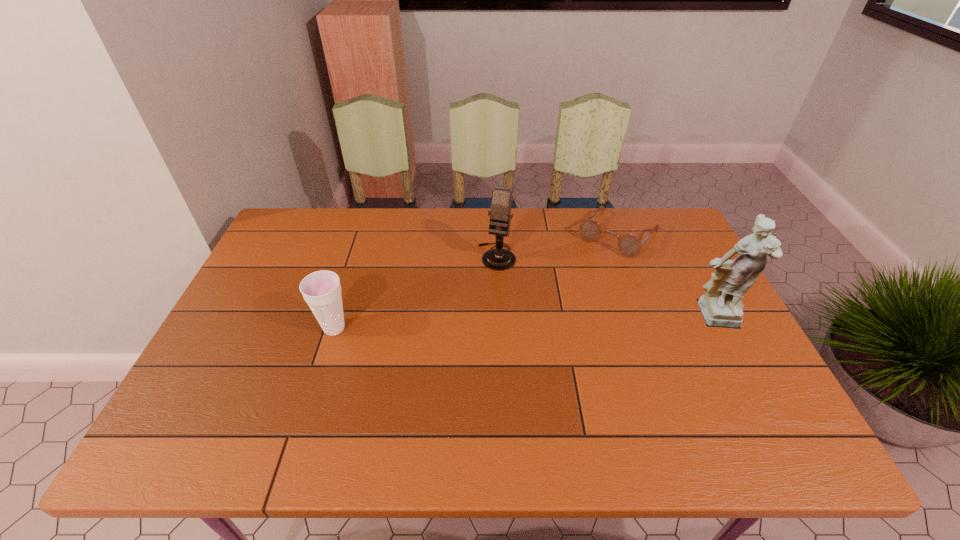
Image resolution: width=960 pixels, height=540 pixels. Identify the location of vacant space on the desktop that is between the leftmost object and the figurine and is positioned on the front-facing side of the third shortest object. (471, 325).

Locate an element on the screen. The image size is (960, 540). free spot on the desktop that is between the leftmost object and the figurine and is positioned on the front-facing side of the shortest object is located at coordinates pyautogui.click(x=544, y=323).